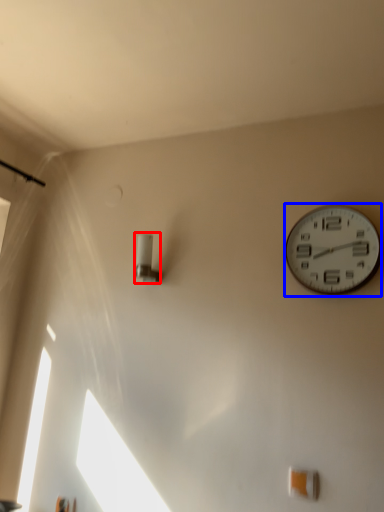
Question: Which of the following is the closest to the observer, light fixture (highlighted by a red box) or wall clock (highlighted by a blue box)?

Choices:
 (A) light fixture
 (B) wall clock

Answer: (B)